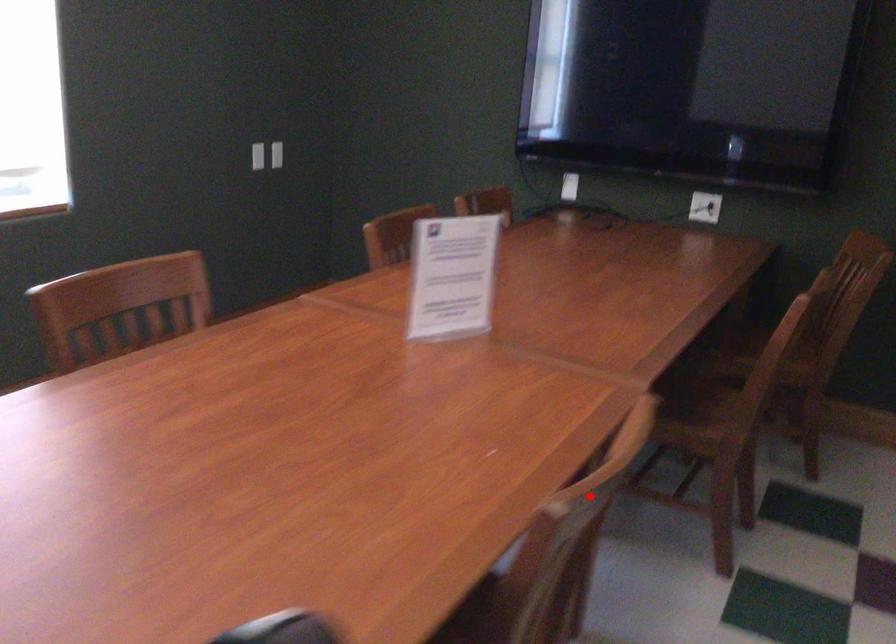
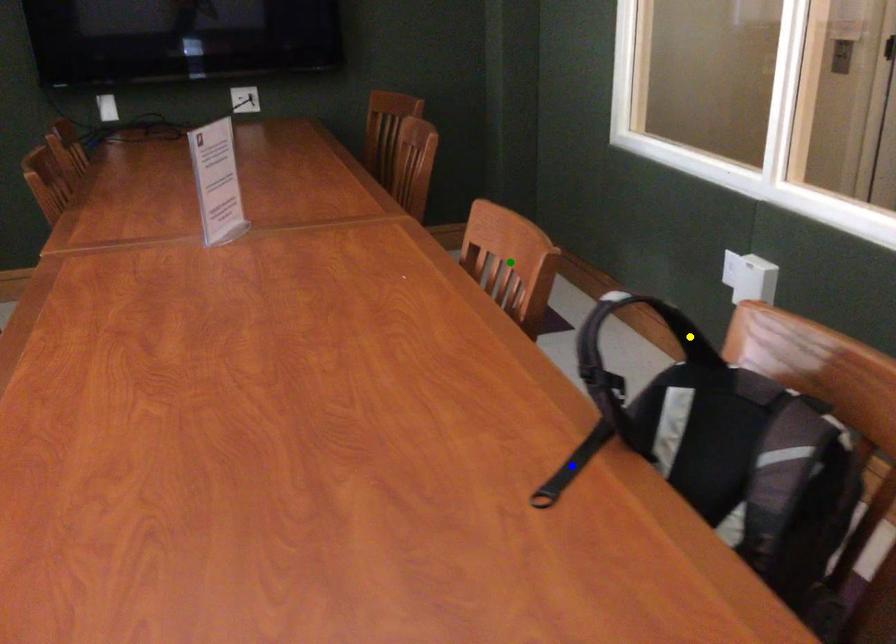
Question: I am providing you with two images of the same scene from different viewpoints. A red point is marked on the first image. You are given multiple points on the second image. Which spot in image 2 lines up with the point in image 1?

Choices:
 (A) green point
 (B) yellow point
 (C) blue point

Answer: (A)